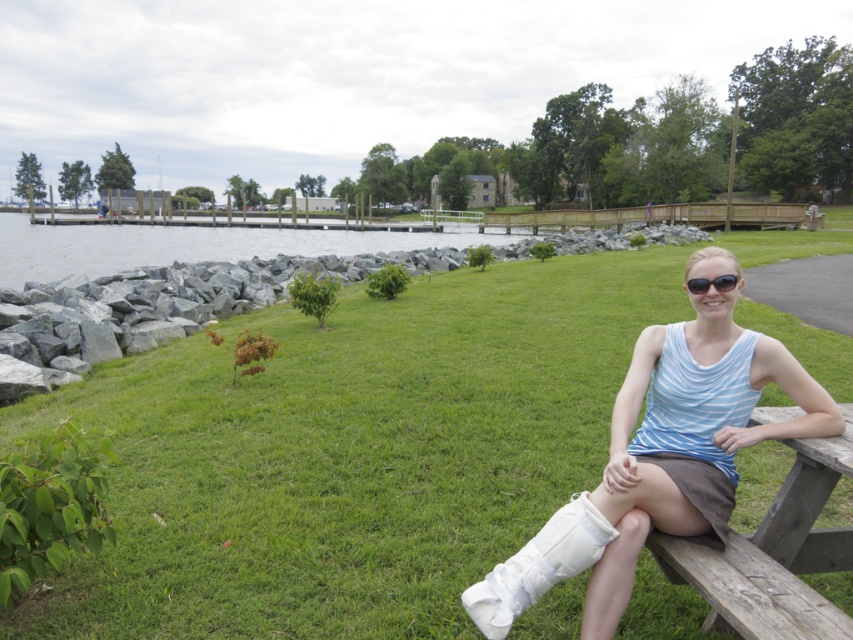
Consider the image. You are a photographer setting up a tripod to take a portrait of the woman sitting on the wooden picnic table. You notice the wooden park bench at lower right and the black plastic sunglasses at upper center in your shot. Which object in the frame is taller?

The wooden park bench at lower right is taller than the black plastic sunglasses at upper center.

In the scene shown: You are standing at the picnic table where the woman is sitting and want to throw a pebble to a point closer to you. Which point should you aim for, point (816, 560) or point (701, 280)?

You should aim for point (816, 560) because it is closer to the viewer than point (701, 280).

You are a landscape architect designing a walking path between the green grass at center and the gray rock water at center. What is the minimum distance you need to plan for the path?

The minimum distance between the green grass at center and the gray rock water at center is 75.88 feet, so the path should be at least that long.